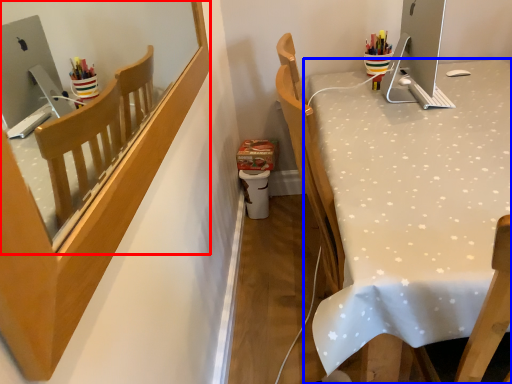
Question: Which object appears closest to the camera in this image, mirror (highlighted by a red box) or desk (highlighted by a blue box)?

Choices:
 (A) mirror
 (B) desk

Answer: (A)